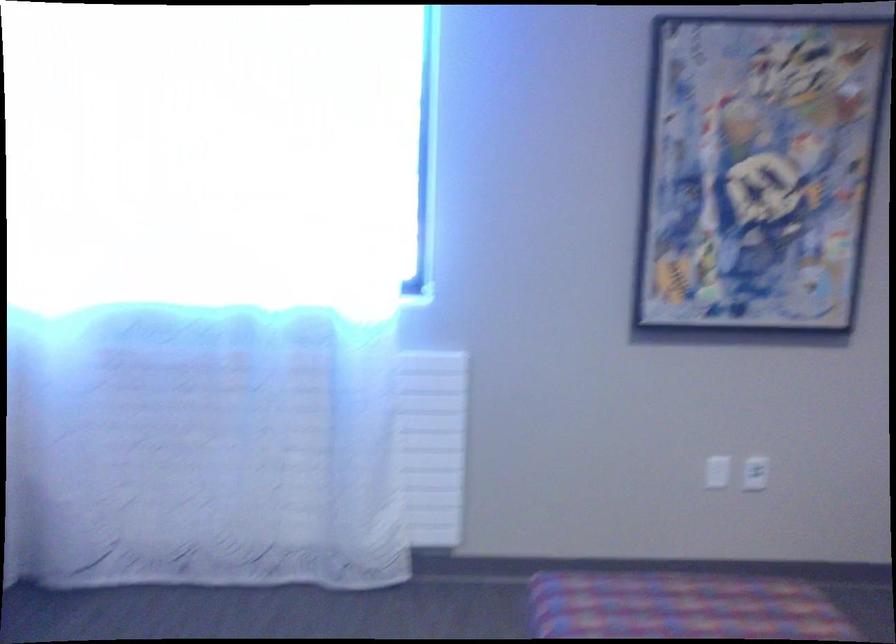
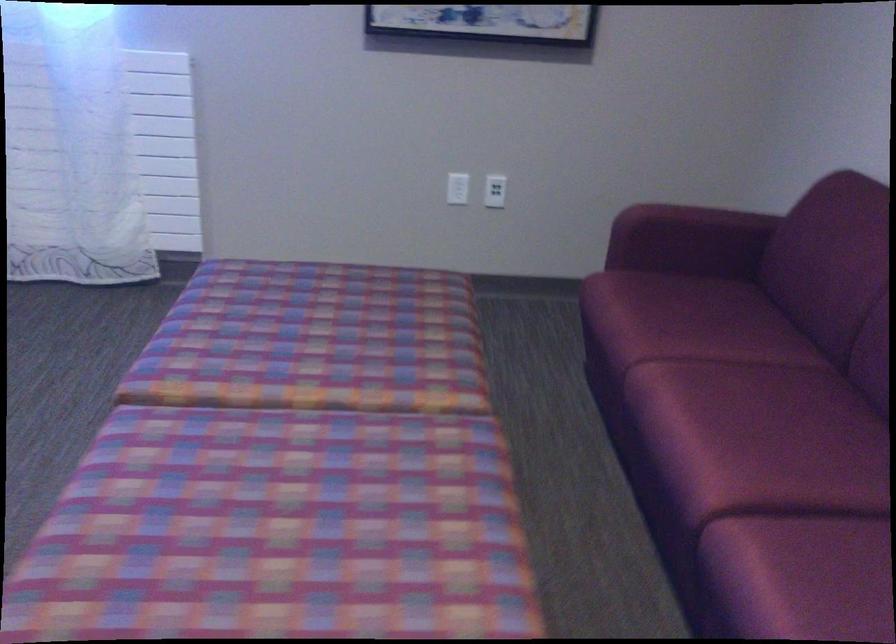
Question: Based on the continuous images, in which direction is the camera rotating? Reply with the corresponding letter.

Choices:
 (A) Left
 (B) Right
 (C) Up
 (D) Down

Answer: (D)